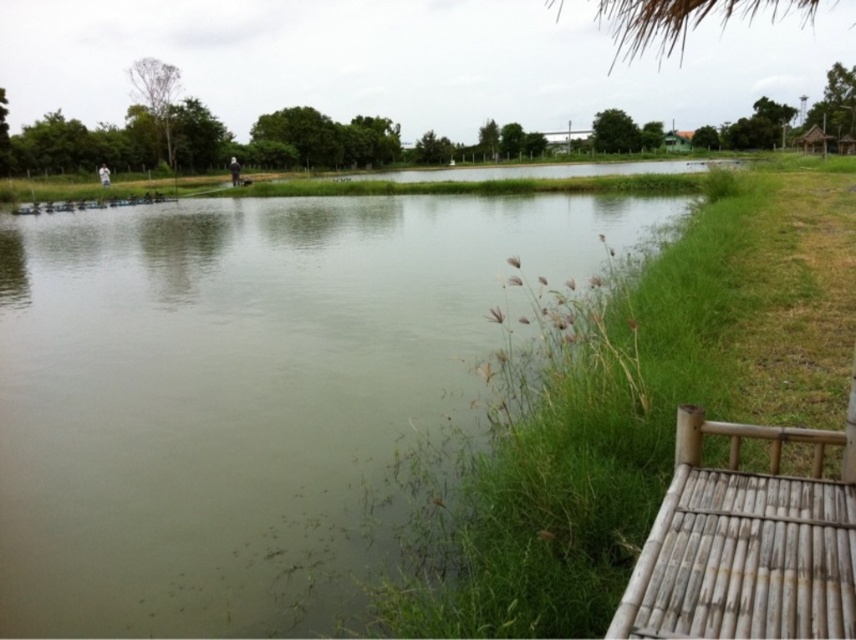
Which is in front, point (259, 589) or point (584, 570)?

Positioned in front is point (584, 570).

Does green grassy water at center appear under green grass at center?

No, green grassy water at center is not below green grass at center.

I want to click on green grassy water at center, so click(241, 388).

Is green grassy water at center positioned before green wooden hut at upper right?

That is True.

Does green grassy water at center appear under green wooden hut at upper right?

Correct, green grassy water at center is located below green wooden hut at upper right.

This screenshot has height=640, width=856. Describe the element at coordinates (241, 388) in the screenshot. I see `green grassy water at center` at that location.

This screenshot has width=856, height=640. In order to click on green grassy water at center in this screenshot , I will do `click(241, 388)`.

Does point (663, 632) come in front of point (672, 148)?

Yes, point (663, 632) is in front of point (672, 148).

Where is `green grass at center`? Image resolution: width=856 pixels, height=640 pixels. green grass at center is located at coordinates (657, 449).